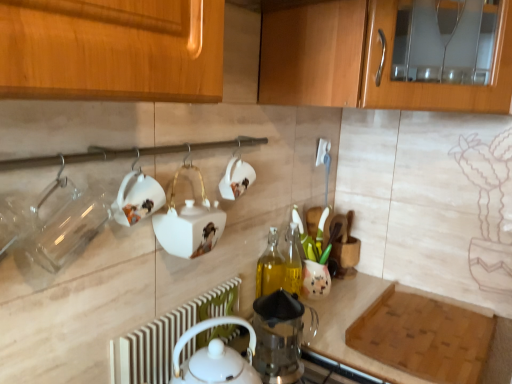
Identify the location of vacant space in front of matte ceramic tea set at center right, the 1th tea set in the back-to-front sequence. This screenshot has height=384, width=512. (329, 320).